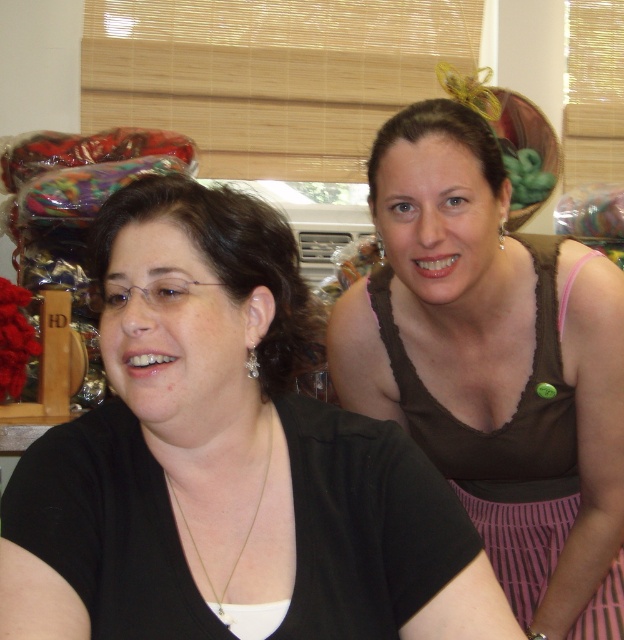
You are a fashion designer looking for a specific fabric for a dress. You see a point marked at coordinates (504, 442) in the image. Which fabric item at upper right is this point located on?

The point at (504, 442) is located on the pink striped fabric dress at upper right.

What are the coordinates of the matte black shirt at upper right?

The coordinates of the matte black shirt at upper right are 0.717 in the x axis and 0.365 in the y axis.

You are a tailor trying to decide which item to place in a small jewelry box. Given the items available, which one between the pink striped fabric dress at upper right and the gold chain necklace at center would fit better?

The gold chain necklace at center would fit better in the small jewelry box since it is smaller than the pink striped fabric dress at upper right.